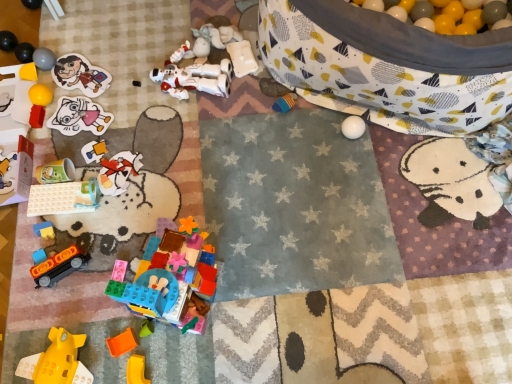
What is the approximate height of orange matte train at lower left, the thirteenth toy in the top-to-bottom sequence?

The height of orange matte train at lower left, the thirteenth toy in the top-to-bottom sequence, is 2.34 inches.

What is the approximate width of orange matte train at lower left, the thirteenth toy in the top-to-bottom sequence?

The width of orange matte train at lower left, the thirteenth toy in the top-to-bottom sequence, is 13.45 centimeters.

What do you see at coordinates (56, 172) in the screenshot?
I see `matte plastic cup at lower left, placed as the ninth toy when sorted from top to bottom` at bounding box center [56, 172].

What is the approximate width of matte gray ball at upper left, marked as the 3th toy in a top-to-bottom arrangement?

matte gray ball at upper left, marked as the 3th toy in a top-to-bottom arrangement, is 2.76 inches wide.

Locate an element on the screen. This screenshot has width=512, height=384. matte red toy at left, marked as the twelfth toy in a bottom-to-top arrangement is located at coordinates (39, 104).

Is translucent yellow plastic toy at lower left, arranged as the fourth toy when ordered from the bottom, outside of blue plastic train at lower left, the 11th toy when ordered from top to bottom?

translucent yellow plastic toy at lower left, arranged as the fourth toy when ordered from the bottom, lies outside blue plastic train at lower left, the 11th toy when ordered from top to bottom,'s area.

Which is behind, translucent yellow plastic toy at lower left, arranged as the fourth toy when ordered from the bottom, or blue plastic train at lower left, positioned as the seventh toy in bottom-to-top order?

Positioned behind is blue plastic train at lower left, positioned as the seventh toy in bottom-to-top order.

Does translucent yellow plastic toy at lower left, arranged as the fourth toy when ordered from the bottom, have a lesser width compared to blue plastic train at lower left, the 11th toy when ordered from top to bottom?

Indeed, translucent yellow plastic toy at lower left, arranged as the fourth toy when ordered from the bottom, has a lesser width compared to blue plastic train at lower left, the 11th toy when ordered from top to bottom.

Does translucent yellow plastic toy at lower left, arranged as the fourth toy when ordered from the bottom, turn towards blue plastic train at lower left, positioned as the seventh toy in bottom-to-top order?

No, translucent yellow plastic toy at lower left, arranged as the fourth toy when ordered from the bottom, is not turned towards blue plastic train at lower left, positioned as the seventh toy in bottom-to-top order.

How many degrees apart are the facing directions of orange plastic block at lower left, the 3th toy positioned from the bottom, and matte paper sticker at upper left, which ranks as the seventh toy in top-to-bottom order?

129 degrees.

Which object is more forward, orange plastic block at lower left, which is the 15th toy from top to bottom, or matte paper sticker at upper left, which ranks as the seventh toy in top-to-bottom order?

orange plastic block at lower left, which is the 15th toy from top to bottom, is in front.

From the image's perspective, does orange plastic block at lower left, the 3th toy positioned from the bottom, appear higher than matte paper sticker at upper left, positioned as the eleventh toy in bottom-to-top order?

Actually, orange plastic block at lower left, the 3th toy positioned from the bottom, appears below matte paper sticker at upper left, positioned as the eleventh toy in bottom-to-top order, in the image.

Based on their positions, is orange plastic block at lower left, the 3th toy positioned from the bottom, located to the left or right of matte paper sticker at upper left, which ranks as the seventh toy in top-to-bottom order?

In the image, orange plastic block at lower left, the 3th toy positioned from the bottom, appears on the right side of matte paper sticker at upper left, which ranks as the seventh toy in top-to-bottom order.

Is the depth of matte plastic cup at lower left, positioned as the 9th toy in bottom-to-top order, less than that of orange plastic block at lower left, the 3th toy positioned from the bottom?

No, it is not.

How many degrees apart are the facing directions of matte plastic cup at lower left, placed as the ninth toy when sorted from top to bottom, and orange plastic block at lower left, which is the 15th toy from top to bottom?

They differ by 16.4 degrees in their facing directions.

From a real-world perspective, which is physically above, matte plastic cup at lower left, placed as the ninth toy when sorted from top to bottom, or orange plastic block at lower left, which is the 15th toy from top to bottom?

matte plastic cup at lower left, placed as the ninth toy when sorted from top to bottom.

Is matte plastic cup at lower left, positioned as the 9th toy in bottom-to-top order, wider or thinner than orange plastic block at lower left, the 3th toy positioned from the bottom?

In the image, matte plastic cup at lower left, positioned as the 9th toy in bottom-to-top order, appears to be wider than orange plastic block at lower left, the 3th toy positioned from the bottom.

Can you see yellow matte plastic block at lower left, the first toy positioned from the bottom, touching yellow matte plastic submarine at lower left, arranged as the 16th toy when viewed from the top?

No, yellow matte plastic block at lower left, the first toy positioned from the bottom, is not in contact with yellow matte plastic submarine at lower left, arranged as the 16th toy when viewed from the top.

Is point (130, 371) in front of point (75, 341)?

No, it is not.

Could you measure the distance between yellow matte plastic block at lower left, the 17th toy positioned from the top, and yellow matte plastic submarine at lower left, which is counted as the 2th toy, starting from the bottom?

yellow matte plastic block at lower left, the 17th toy positioned from the top, is 16.30 centimeters from yellow matte plastic submarine at lower left, which is counted as the 2th toy, starting from the bottom.

From the image's perspective, between yellow matte plastic block at lower left, the first toy positioned from the bottom, and yellow matte plastic submarine at lower left, arranged as the 16th toy when viewed from the top, which one is located above?

yellow matte plastic submarine at lower left, arranged as the 16th toy when viewed from the top, from the image's perspective.

Considering the relative sizes of translucent plastic cup at left, the 10th toy ordered from the bottom, and matte plastic cup at upper left, positioned as the 1th toy in top-to-bottom order, in the image provided, is translucent plastic cup at left, the 10th toy ordered from the bottom, shorter than matte plastic cup at upper left, positioned as the 1th toy in top-to-bottom order,?

Yes.

Which is more to the right, translucent plastic cup at left, which appears as the eighth toy when viewed from the top, or matte plastic cup at upper left, positioned as the 1th toy in top-to-bottom order?

From the viewer's perspective, translucent plastic cup at left, which appears as the eighth toy when viewed from the top, appears more on the right side.

What's the angular difference between translucent plastic cup at left, which appears as the eighth toy when viewed from the top, and matte plastic cup at upper left, which appears as the 17th toy when ordered from the bottom,'s facing directions?

translucent plastic cup at left, which appears as the eighth toy when viewed from the top, and matte plastic cup at upper left, which appears as the 17th toy when ordered from the bottom, are facing 0.00387 degrees away from each other.

From a real-world perspective, relative to matte plastic cup at upper left, positioned as the 1th toy in top-to-bottom order, is translucent plastic cup at left, the 10th toy ordered from the bottom, vertically above or below?

In terms of real-world spatial position, translucent plastic cup at left, the 10th toy ordered from the bottom, is below matte plastic cup at upper left, positioned as the 1th toy in top-to-bottom order.

Locate an element on the screen. the 4th toy to the right of the translucent plastic cup at left, which appears as the eighth toy when viewed from the top, counting from the anchor's position is located at coordinates (56, 172).

Would you say matte plastic cup at lower left, positioned as the 9th toy in bottom-to-top order, is part of translucent plastic cup at left, which appears as the eighth toy when viewed from the top,'s contents?

No, matte plastic cup at lower left, positioned as the 9th toy in bottom-to-top order, is not inside translucent plastic cup at left, which appears as the eighth toy when viewed from the top.

Is translucent plastic cup at left, which appears as the eighth toy when viewed from the top, positioned with its back to matte plastic cup at lower left, placed as the ninth toy when sorted from top to bottom?

No, translucent plastic cup at left, which appears as the eighth toy when viewed from the top, is not facing away from matte plastic cup at lower left, placed as the ninth toy when sorted from top to bottom.

From the image's perspective, does translucent plastic cup at left, which appears as the eighth toy when viewed from the top, appear lower than matte plastic cup at lower left, placed as the ninth toy when sorted from top to bottom?

No, from the image's perspective, translucent plastic cup at left, which appears as the eighth toy when viewed from the top, is not below matte plastic cup at lower left, placed as the ninth toy when sorted from top to bottom.

From the image's perspective, does white plastic building blocks at lower left, acting as the 8th toy starting from the bottom, appear higher than yellow matte plastic block at lower left, the first toy positioned from the bottom?

Yes, from the image's perspective, white plastic building blocks at lower left, acting as the 8th toy starting from the bottom, is over yellow matte plastic block at lower left, the first toy positioned from the bottom.

From a real-world perspective, which object stands above the other?

white plastic building blocks at lower left, acting as the 8th toy starting from the bottom, is physically above.

You are a GUI agent. You are given a task and a screenshot of the screen. Output one action in this format:
    pyautogui.click(x=<x>, y=<y>)
    Task: Click on the toy that is the 7th one when counting upward from the yellow matte plastic block at lower left, the 17th toy positioned from the top (from the image's perspective)
    The height and width of the screenshot is (384, 512).
    Given the screenshot: What is the action you would take?
    pyautogui.click(x=63, y=198)

Find the location of a particular element. The width and height of the screenshot is (512, 384). the 9th toy counting from the left side of the translucent yellow plastic toy at lower left, arranged as the fourth toy when ordered from the bottom is located at coordinates (44, 230).

From the image's perspective, which toy is the 8th one above the orange plastic block at lower left, the 3th toy positioned from the bottom? Please provide its 2D coordinates.

[(79, 116)]

From the image, which object appears to be farther from orange plastic block at lower left, which is the 15th toy from top to bottom, yellow matte plastic block at lower left, the first toy positioned from the bottom, or blue plastic train at lower left, positioned as the seventh toy in bottom-to-top order?

Based on the image, blue plastic train at lower left, positioned as the seventh toy in bottom-to-top order, appears to be further to orange plastic block at lower left, which is the 15th toy from top to bottom.

From the image, which object appears to be nearer to yellow matte plastic block at lower left, the first toy positioned from the bottom, yellow matte plastic submarine at lower left, arranged as the 16th toy when viewed from the top, or blue plastic train at lower left, the 11th toy when ordered from top to bottom?

yellow matte plastic submarine at lower left, arranged as the 16th toy when viewed from the top.

Considering their positions, is orange matte train at lower left, the 5th toy in the bottom-to-top sequence, positioned closer to blue plastic train at lower left, the 11th toy when ordered from top to bottom, than matte gray ball at upper left, marked as the fifteenth toy in a bottom-to-top arrangement?

orange matte train at lower left, the 5th toy in the bottom-to-top sequence, is closer to blue plastic train at lower left, the 11th toy when ordered from top to bottom.

When comparing their distances from white matte toy at upper center, the second toy viewed from the top, does white plastic robot at center, positioned as the fourth toy in top-to-bottom order, or matte paper sticker at upper left, positioned as the eleventh toy in bottom-to-top order, seem further?

matte paper sticker at upper left, positioned as the eleventh toy in bottom-to-top order, is further to white matte toy at upper center, the second toy viewed from the top.

When comparing their distances from yellow matte plastic block at lower left, the first toy positioned from the bottom, does white plastic building blocks at lower left, the 10th toy in the top-to-bottom sequence, or translucent plastic building blocks at lower center, placed as the 12th toy when sorted from top to bottom, seem further?

white plastic building blocks at lower left, the 10th toy in the top-to-bottom sequence, is positioned further to the anchor yellow matte plastic block at lower left, the first toy positioned from the bottom.

Which object lies further to the anchor point white plastic robot at center, which appears as the fourteenth toy when ordered from the bottom, matte red toy at left, marked as the 6th toy in a top-to-bottom arrangement, or matte plastic cup at upper left, positioned as the 1th toy in top-to-bottom order?

matte plastic cup at upper left, positioned as the 1th toy in top-to-bottom order, is further to white plastic robot at center, which appears as the fourteenth toy when ordered from the bottom.

From the image, which object appears to be farther from matte paper sticker at upper left, which ranks as the seventh toy in top-to-bottom order, yellow matte plastic submarine at lower left, arranged as the 16th toy when viewed from the top, or matte red toy at left, marked as the 6th toy in a top-to-bottom arrangement?

yellow matte plastic submarine at lower left, arranged as the 16th toy when viewed from the top, is further to matte paper sticker at upper left, which ranks as the seventh toy in top-to-bottom order.

Estimate the real-world distances between objects in this image. Which object is further from matte paper sticker at upper left, positioned as the eleventh toy in bottom-to-top order, matte paper sticker at upper left, which is counted as the 13th toy, starting from the bottom, or yellow matte plastic submarine at lower left, which is counted as the 2th toy, starting from the bottom?

yellow matte plastic submarine at lower left, which is counted as the 2th toy, starting from the bottom, is further to matte paper sticker at upper left, positioned as the eleventh toy in bottom-to-top order.

You are a GUI agent. You are given a task and a screenshot of the screen. Output one action in this format:
    pyautogui.click(x=<x>, y=<y>)
    Task: Click on the toy that lies between matte paper sticker at upper left, which is counted as the 13th toy, starting from the bottom, and matte paper sticker at upper left, positioned as the eleventh toy in bottom-to-top order, from top to bottom
    Image resolution: width=512 pixels, height=384 pixels.
    Given the screenshot: What is the action you would take?
    pyautogui.click(x=39, y=104)

Find the location of a particular element. The image size is (512, 384). toy between matte plastic cup at lower left, positioned as the 9th toy in bottom-to-top order, and blue plastic train at lower left, the 11th toy when ordered from top to bottom, vertically is located at coordinates (63, 198).

Find the location of a particular element. The width and height of the screenshot is (512, 384). toy between yellow matte plastic submarine at lower left, arranged as the 16th toy when viewed from the top, and yellow matte plastic block at lower left, the first toy positioned from the bottom, in the horizontal direction is located at coordinates (122, 343).